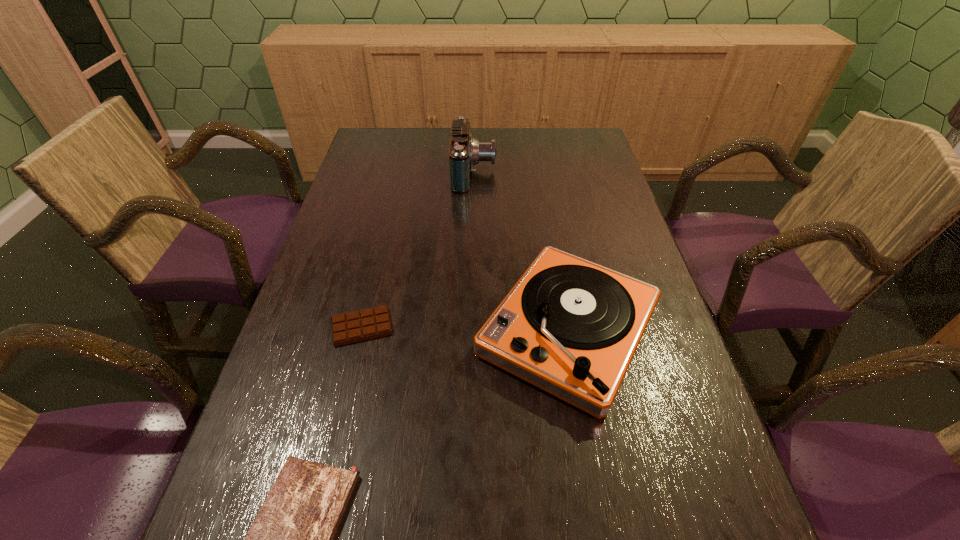
Where is `the farthest object`? The image size is (960, 540). the farthest object is located at coordinates (464, 152).

Where is `the tallest object`? the tallest object is located at coordinates [x=464, y=152].

At what (x,y) coordinates should I click in order to perform the action: click on record player. Please return your answer as a coordinate pair (x, y). The image size is (960, 540). Looking at the image, I should click on (570, 327).

Identify the location of candy bar. The image size is (960, 540). (356, 326).

Where is `free space located 0.140m on the front-facing side of the farthest object`? The image size is (960, 540). free space located 0.140m on the front-facing side of the farthest object is located at coordinates (540, 173).

At what (x,y) coordinates should I click in order to perform the action: click on free space located on the left of the third shortest object. Please return your answer as a coordinate pair (x, y). The height and width of the screenshot is (540, 960). Looking at the image, I should click on (414, 330).

Image resolution: width=960 pixels, height=540 pixels. Find the location of `free space located on the back of the candy bar`. free space located on the back of the candy bar is located at coordinates (374, 274).

Where is `object situated at the far edge`? This screenshot has width=960, height=540. object situated at the far edge is located at coordinates 464,152.

I want to click on object that is at the left edge, so click(x=356, y=326).

Identify the location of object that is positioned at the right edge. (570, 327).